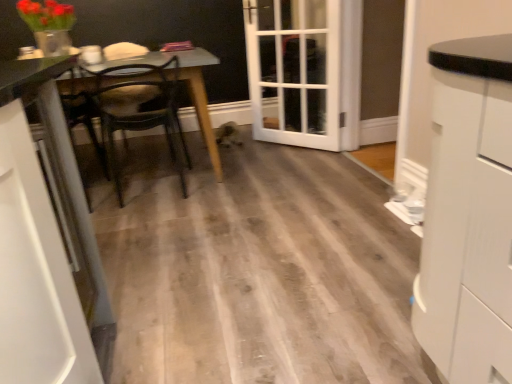
Question: From the image's perspective, does white glass door at center appear higher than wooden chair at center?

Choices:
 (A) yes
 (B) no

Answer: (A)

Question: Does white glass door at center have a greater height compared to wooden chair at center?

Choices:
 (A) no
 (B) yes

Answer: (B)

Question: Is white glass door at center not close to wooden chair at center?

Choices:
 (A) no
 (B) yes

Answer: (A)

Question: From a real-world perspective, is white glass door at center located beneath wooden chair at center?

Choices:
 (A) no
 (B) yes

Answer: (A)

Question: Is white glass door at center surrounding wooden chair at center?

Choices:
 (A) no
 (B) yes

Answer: (A)

Question: From the image's perspective, is white glass door at center located beneath wooden chair at center?

Choices:
 (A) yes
 (B) no

Answer: (B)

Question: Is wooden chair at center facing towards white glossy cabinet at left, which ranks as the second cabinetry in right-to-left order?

Choices:
 (A) yes
 (B) no

Answer: (B)

Question: From the image's perspective, would you say wooden chair at center is shown under white glossy cabinet at left, arranged as the 1th cabinetry when viewed from the left?

Choices:
 (A) yes
 (B) no

Answer: (B)

Question: Is wooden chair at center touching white glossy cabinet at left, which ranks as the second cabinetry in right-to-left order?

Choices:
 (A) no
 (B) yes

Answer: (A)

Question: Can you confirm if wooden chair at center is taller than white glossy cabinet at left, which ranks as the second cabinetry in right-to-left order?

Choices:
 (A) yes
 (B) no

Answer: (B)

Question: From the image's perspective, is wooden chair at center over white glossy cabinet at left, arranged as the 1th cabinetry when viewed from the left?

Choices:
 (A) yes
 (B) no

Answer: (A)

Question: From a real-world perspective, is wooden chair at center physically below white glossy cabinet at left, which ranks as the second cabinetry in right-to-left order?

Choices:
 (A) no
 (B) yes

Answer: (B)

Question: From the image's perspective, is white glass door at center beneath wooden table at left?

Choices:
 (A) no
 (B) yes

Answer: (A)